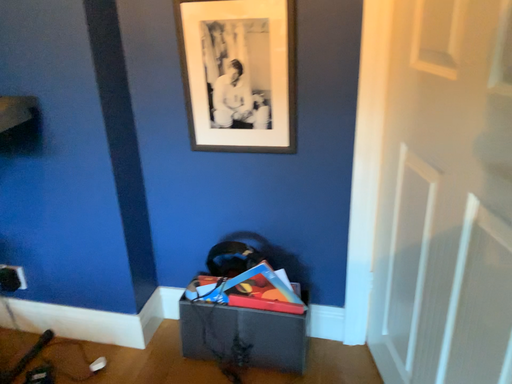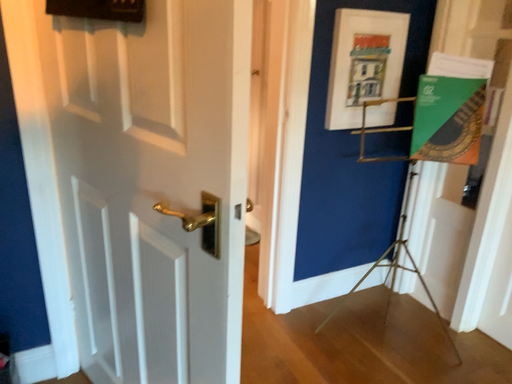
Question: Which way did the camera rotate in the video?

Choices:
 (A) rotated downward
 (B) rotated upward

Answer: (B)